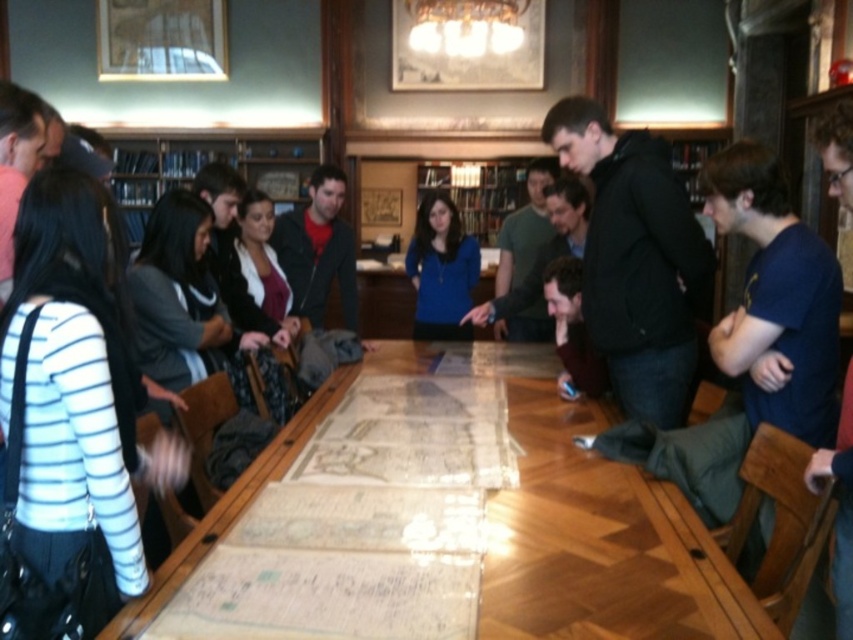
You are a researcher who needs to reach the blue fabric bookshelf at upper center from your current position near the blue matte sweater at center. Can you comfortably walk to it without needing to move any furniture?

The blue fabric bookshelf at upper center is 8.65 feet away from the blue matte sweater at center, so yes, you can comfortably walk to it without needing to move any furniture as the distance is sufficient for movement.

You are a researcher who needs to place a 1.2 meter tall book on the table. Given the wooden map at center and the blue matte sweater at center, which object must you move to accommodate the book?

The blue matte sweater at center must be moved because the wooden map at center is not as tall as the blue matte sweater at center, meaning the sweater is taller and occupies more vertical space, making it the object needing relocation to fit the 1.2 meter tall book.

You are standing in the library and need to locate the point at coordinates (601, 544). Where exactly on the wooden map at center would you find this point?

The point at coordinates (601, 544) is located on the wooden map at center.